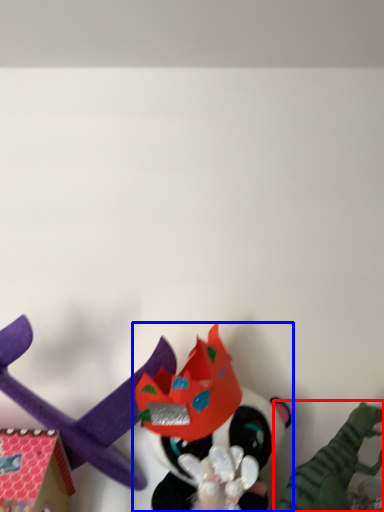
Question: Which of the following is the farthest to the observer, toy (highlighted by a red box) or toy (highlighted by a blue box)?

Choices:
 (A) toy
 (B) toy

Answer: (B)